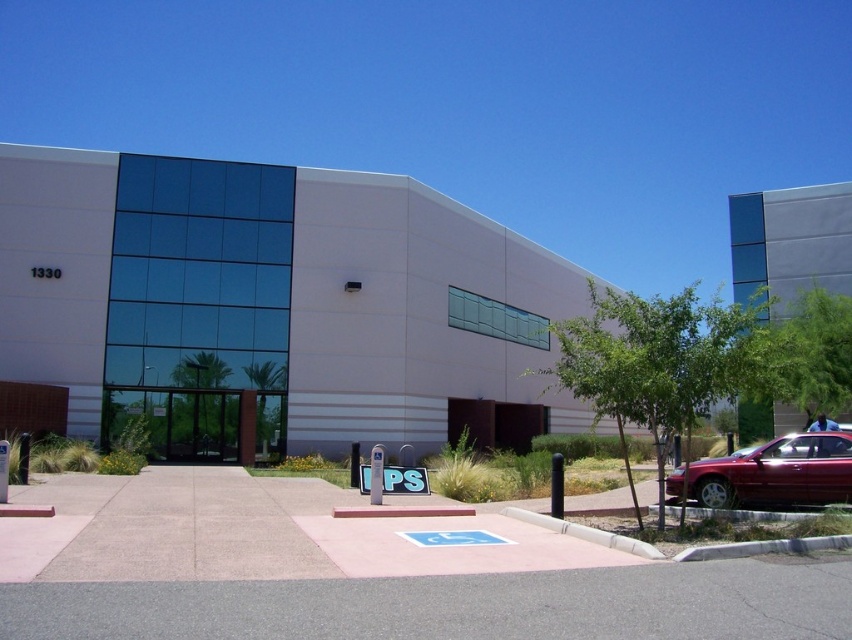
Looking at this image, you are a delivery person needing to park your 5.5 meter long glossy metallic sedan at lower right. The parking space on the gray asphalt pavement at lower center is available. Can your vehicle fit in the parking space?

The gray asphalt pavement at lower center is shorter than the glossy metallic sedan at lower right, so the parking space is not long enough to accommodate the vehicle.

You are a delivery driver approaching the commercial building and need to park in the handicapped parking space. You notice the gray asphalt pavement at lower center and the white plastic parking sign at center. Which object is narrower?

The gray asphalt pavement at lower center has a lesser width compared to the white plastic parking sign at center, so the gray asphalt pavement at lower center is narrower.

You are standing in front of the commercial building and need to locate two specific points marked on the parking lot. The first point is at coordinates point (691,477) and the second is at point (366,477). Which of these points is closer to you as you face the building?

Point (691,477) is closer to the viewer than point (366,477).